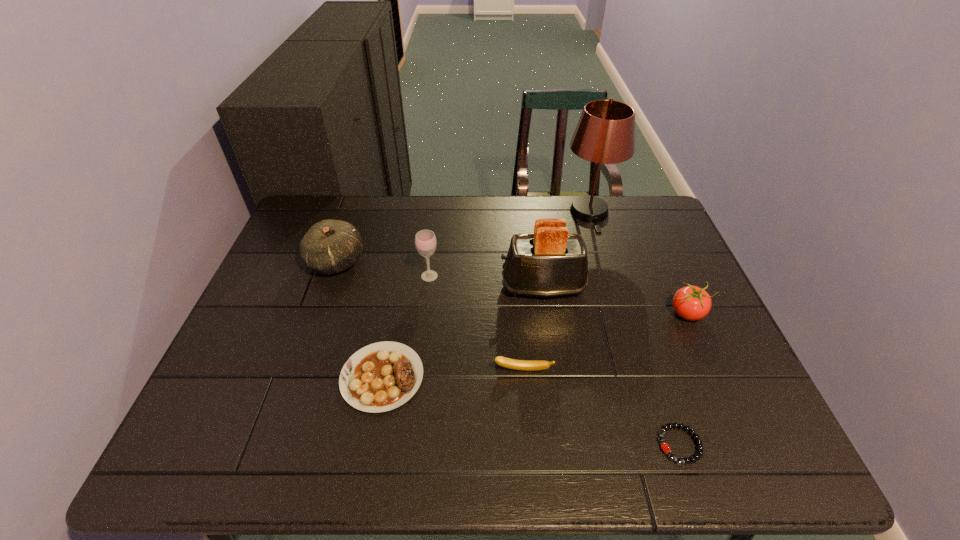
Identify the location of the farthest object. point(605,133).

Find the location of a particular element. The height and width of the screenshot is (540, 960). the tallest object is located at coordinates (605, 133).

Locate an element on the screen. The width and height of the screenshot is (960, 540). the second tallest object is located at coordinates (550, 262).

You are a GUI agent. You are given a task and a screenshot of the screen. Output one action in this format:
    pyautogui.click(x=<x>, y=<y>)
    Task: Click on the wineglass
    Image resolution: width=960 pixels, height=540 pixels.
    Given the screenshot: What is the action you would take?
    pyautogui.click(x=425, y=240)

In order to click on gourd in this screenshot , I will do `click(330, 246)`.

The height and width of the screenshot is (540, 960). What are the coordinates of `the rightmost object` in the screenshot? It's located at (692, 303).

Locate an element on the screen. The image size is (960, 540). tomato is located at coordinates (692, 303).

At what (x,y) coordinates should I click in order to perform the action: click on banana. Please return your answer as a coordinate pair (x, y). Looking at the image, I should click on (528, 365).

This screenshot has height=540, width=960. I want to click on the second shortest object, so click(x=382, y=376).

Where is `the nearest object`? Image resolution: width=960 pixels, height=540 pixels. the nearest object is located at coordinates (665, 447).